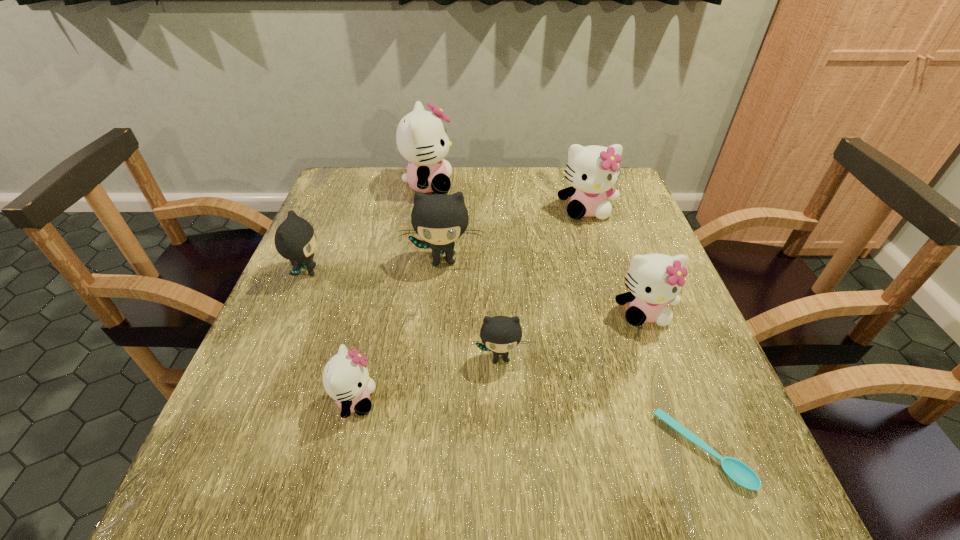
Identify the location of vacant space that satisfies the following two spatial constraints: 1. on the front-facing side of the nearest kitten; 2. on the back side of the shortest object. (343, 450).

Locate an element on the screen. This screenshot has width=960, height=540. vacant space that satisfies the following two spatial constraints: 1. on the front-facing side of the leftmost kitten; 2. on the right side of the spoon is located at coordinates (231, 450).

The image size is (960, 540). In order to click on vacant space that satisfies the following two spatial constraints: 1. on the front-facing side of the smallest gray kitten; 2. on the front-facing side of the nearest kitten in this screenshot , I will do `click(502, 400)`.

Find the location of a particular element. vacant point that satisfies the following two spatial constraints: 1. on the front-facing side of the third nearest kitten; 2. on the front-facing side of the nearest kitten is located at coordinates (676, 400).

Identify the location of free spot that satisfies the following two spatial constraints: 1. on the front-facing side of the second biggest white kitten; 2. on the front-facing side of the leftmost kitten. (605, 272).

The width and height of the screenshot is (960, 540). I want to click on free spot that satisfies the following two spatial constraints: 1. on the front-facing side of the biggest gray kitten; 2. on the front-facing side of the nearest white kitten, so click(x=430, y=400).

You are a GUI agent. You are given a task and a screenshot of the screen. Output one action in this format:
    pyautogui.click(x=<x>, y=<y>)
    Task: Click on the free space that satisfies the following two spatial constraints: 1. on the front-facing side of the third smallest white kitten; 2. on the front-facing side of the smallest white kitten
    This screenshot has height=540, width=960.
    Given the screenshot: What is the action you would take?
    pyautogui.click(x=644, y=400)